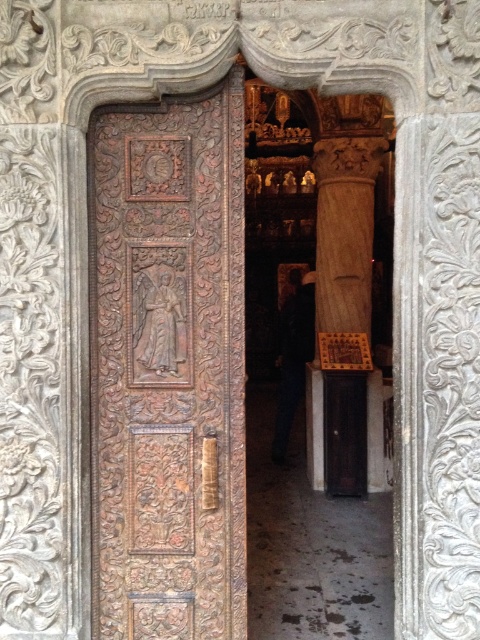
Does carved wood door at center appear over smooth stone column at center?

Incorrect, carved wood door at center is not positioned above smooth stone column at center.

Which is above, carved wood door at center or smooth stone column at center?

Positioned higher is smooth stone column at center.

Who is more forward, (228, 616) or (355, 458)?

Point (228, 616) is in front.

The width and height of the screenshot is (480, 640). Identify the location of carved wood door at center. (168, 365).